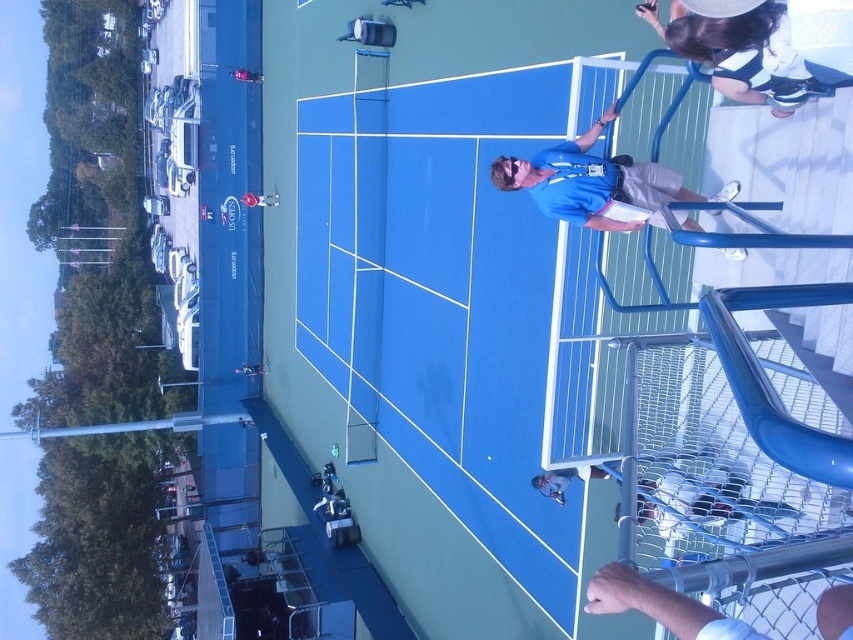
Question: Is white cotton shirt at upper right further to the viewer compared to metallic silver pole at lower right?

Choices:
 (A) yes
 (B) no

Answer: (A)

Question: Considering the real-world distances, which object is closest to the metallic silver tennis racket at center?

Choices:
 (A) white fabric tennis racket at center
 (B) white cotton shirt at upper right
 (C) blue fabric shirt at upper center
 (D) metallic silver pole at lower right

Answer: (A)

Question: Which point appears closest to the camera in this image?

Choices:
 (A) (540, 474)
 (B) (759, 40)
 (C) (587, 225)
 (D) (693, 625)

Answer: (D)

Question: Estimate the real-world distances between objects in this image. Which object is closer to the blue fabric shirt at upper center?

Choices:
 (A) metallic silver pole at lower right
 (B) white fabric tennis racket at center
 (C) white cotton shirt at upper right

Answer: (C)

Question: Is white fabric tennis racket at center to the right of metallic silver tennis racket at center from the viewer's perspective?

Choices:
 (A) yes
 (B) no

Answer: (A)

Question: Can you confirm if metallic silver pole at lower right is positioned above white fabric tennis racket at center?

Choices:
 (A) yes
 (B) no

Answer: (A)